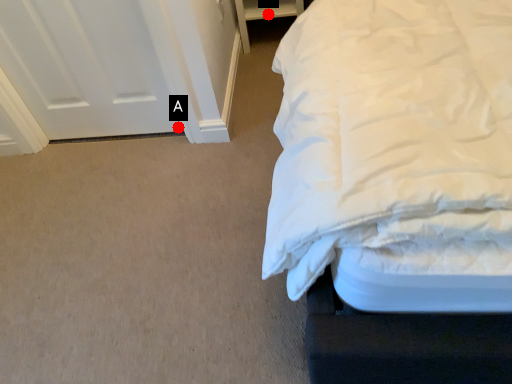
Question: Two points are circled on the image, labeled by A and B beside each circle. Which of the following is the farthest from the observer?

Choices:
 (A) A is further
 (B) B is further

Answer: (B)